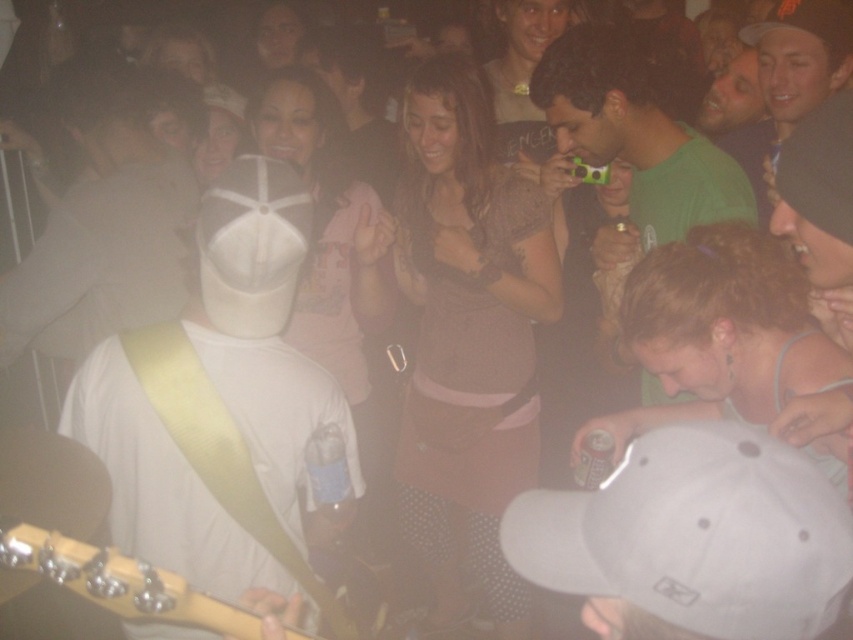
Question: Which point is farther to the camera?

Choices:
 (A) (28, 333)
 (B) (721, 486)
 (C) (593, 60)

Answer: (A)

Question: Is green matte camera at center to the right of smooth black cap at upper right from the viewer's perspective?

Choices:
 (A) no
 (B) yes

Answer: (A)

Question: Is white fabric cap at center thinner than white matte baseball cap at center?

Choices:
 (A) yes
 (B) no

Answer: (B)

Question: Can you confirm if white matte baseball cap at center is positioned above wooden acoustic guitar at left?

Choices:
 (A) no
 (B) yes

Answer: (B)

Question: Estimate the real-world distances between objects in this image. Which object is farther from the white matte baseball cap at center?

Choices:
 (A) white fabric baseball cap at center
 (B) smooth black cap at upper right
 (C) white matte hat at left
 (D) white fabric cap at center

Answer: (B)

Question: Which point is closer to the camera?

Choices:
 (A) white fabric baseball cap at center
 (B) green matte camera at center
 (C) white fabric cap at center

Answer: (A)